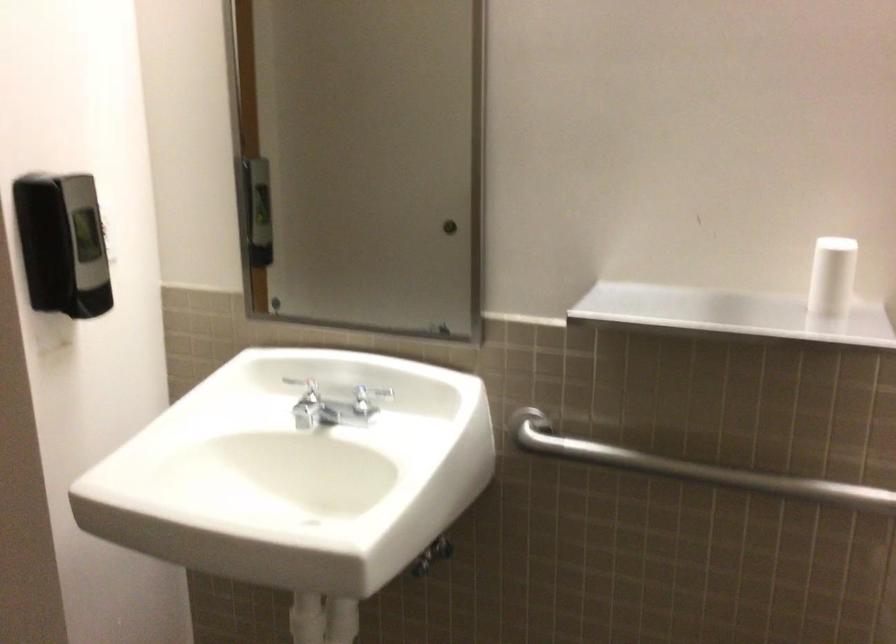
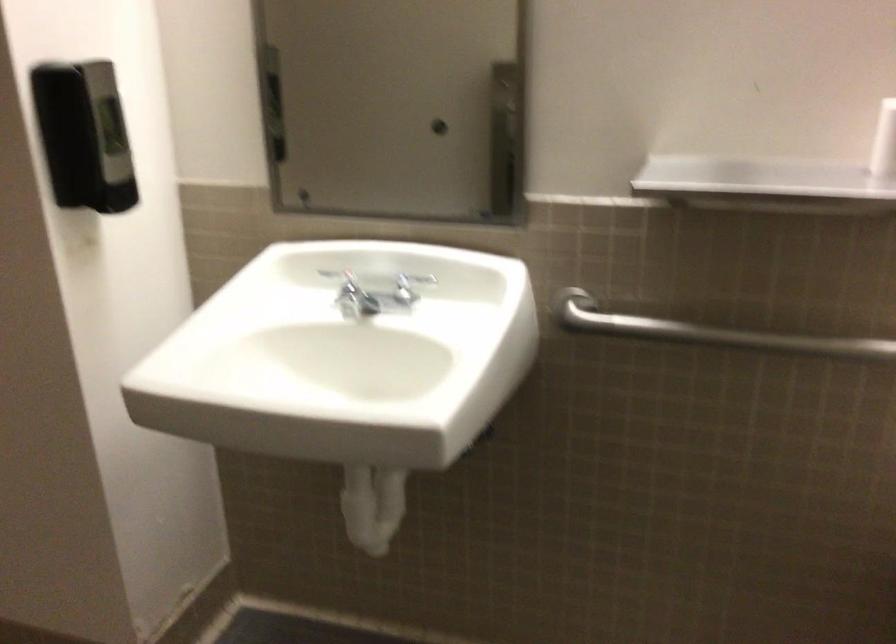
Question: In a continuous first-person perspective shot, in which direction is the camera moving?

Choices:
 (A) Left
 (B) Right
 (C) Forward
 (D) Backward

Answer: (A)